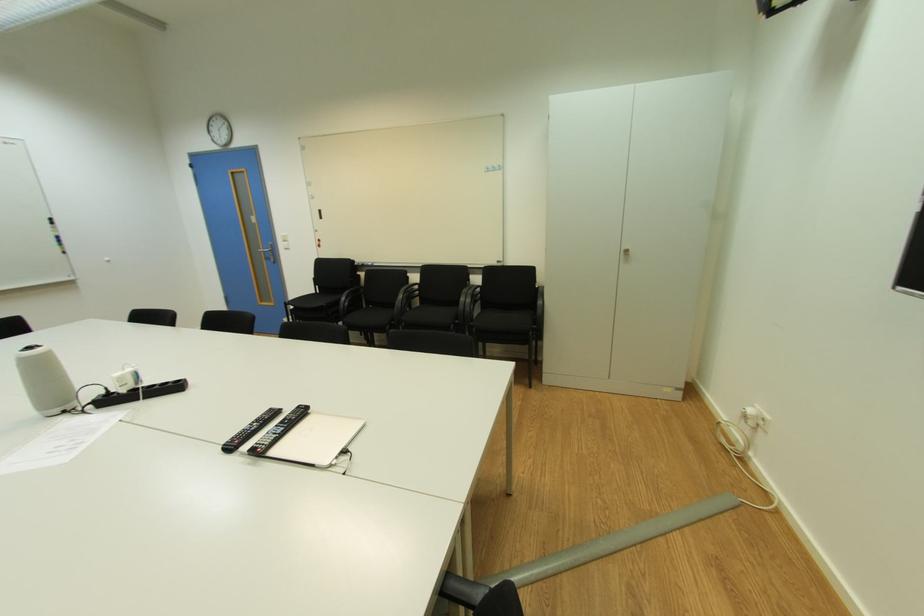
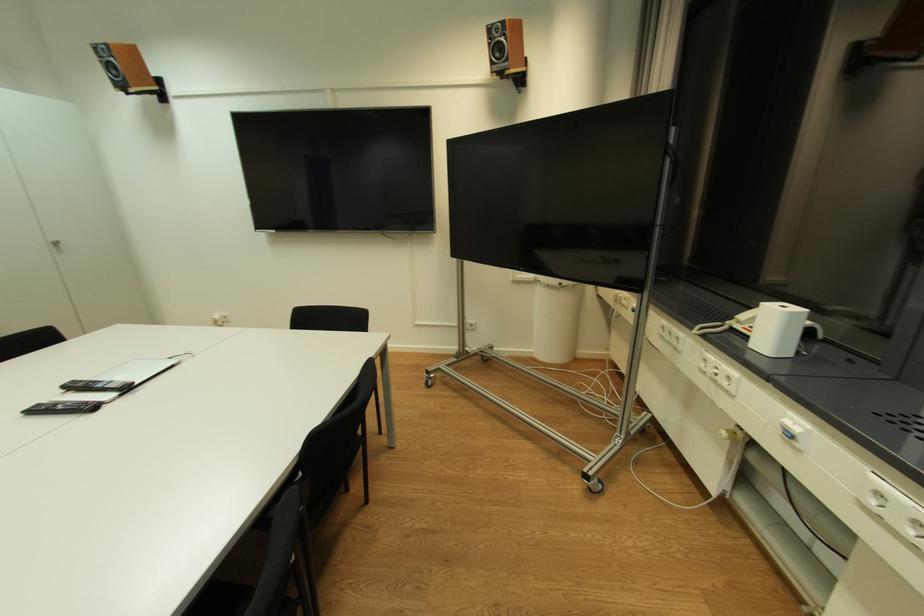
The point at (628, 254) is marked in the first image. Where is the corresponding point in the second image?

(57, 246)